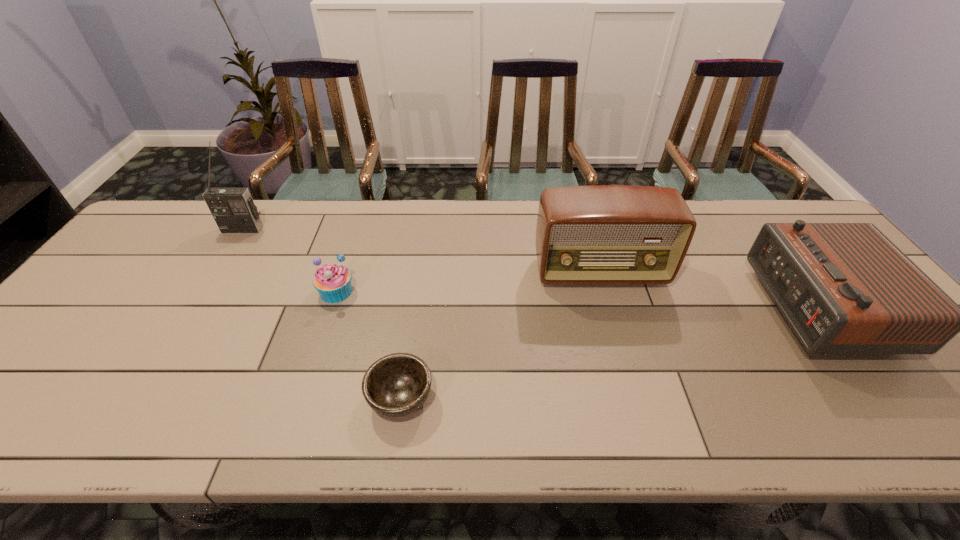
The width and height of the screenshot is (960, 540). Identify the location of vacant space located on the display of the leftmost radio receiver. (203, 295).

Locate an element on the screen. The image size is (960, 540). vacant space located on the front-facing side of the fourth object from left to right is located at coordinates (626, 366).

Where is `vacant point located on the tuning display of the rightmost radio receiver`? The height and width of the screenshot is (540, 960). vacant point located on the tuning display of the rightmost radio receiver is located at coordinates (692, 307).

The image size is (960, 540). Identify the location of free space located on the tuning display of the rightmost radio receiver. (676, 307).

What are the coordinates of `free space located 0.070m on the tuning display of the rightmost radio receiver` in the screenshot? It's located at (738, 307).

I want to click on vacant region located on the right of the muffin, so click(493, 292).

Identify the location of free space located on the right of the bowl. coord(555,398).

The image size is (960, 540). Find the location of `object located at the far edge`. object located at the far edge is located at coordinates (233, 209).

The height and width of the screenshot is (540, 960). In order to click on object positioned at the near edge in this screenshot , I will do `click(396, 385)`.

Locate an element on the screen. Image resolution: width=960 pixels, height=540 pixels. object at the right edge is located at coordinates (844, 288).